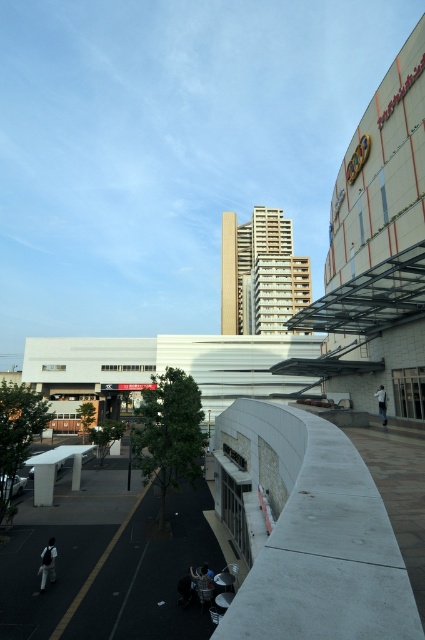
Question: Which object is farther from the camera taking this photo?

Choices:
 (A) white fabric bag at lower right
 (B) metallic silver water bottle at lower center
 (C) dark gray fabric jacket at lower left

Answer: (A)

Question: Is dark gray fabric jacket at lower left positioned in front of metallic silver water bottle at lower center?

Choices:
 (A) yes
 (B) no

Answer: (B)

Question: Estimate the real-world distances between objects in this image. Which object is closer to the white fabric bag at lower right?

Choices:
 (A) metallic silver water bottle at lower center
 (B) dark gray fabric jacket at lower left

Answer: (A)

Question: Is dark gray fabric jacket at lower left behind white fabric bag at lower right?

Choices:
 (A) no
 (B) yes

Answer: (A)

Question: Can you confirm if dark gray fabric jacket at lower left is positioned below metallic silver water bottle at lower center?

Choices:
 (A) yes
 (B) no

Answer: (A)

Question: Which of the following is the farthest from the observer?

Choices:
 (A) (54, 572)
 (B) (206, 584)
 (C) (385, 422)

Answer: (C)